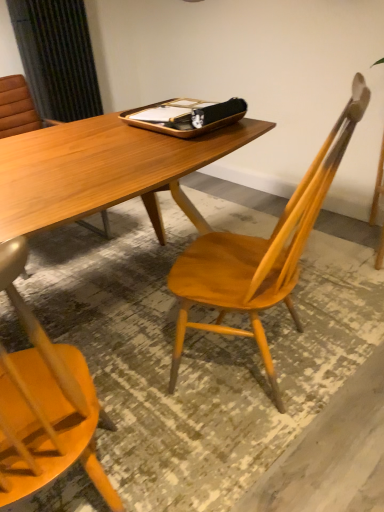
Question: In the image, is wooden tray at center on the left side or the right side of wooden chair at center?

Choices:
 (A) right
 (B) left

Answer: (B)

Question: Looking at the image, does wooden tray at center seem bigger or smaller compared to wooden chair at center?

Choices:
 (A) big
 (B) small

Answer: (B)

Question: Is point (215, 118) positioned closer to the camera than point (322, 155)?

Choices:
 (A) closer
 (B) farther

Answer: (B)

Question: From the image's perspective, is wooden chair at center positioned above or below wooden tray at center?

Choices:
 (A) above
 (B) below

Answer: (B)

Question: Considering the relative positions of wooden chair at center and wooden tray at center in the image provided, is wooden chair at center to the left or to the right of wooden tray at center?

Choices:
 (A) right
 (B) left

Answer: (A)

Question: Does point (344, 115) appear closer or farther from the camera than point (233, 101)?

Choices:
 (A) closer
 (B) farther

Answer: (A)

Question: Would you say wooden chair at center is inside or outside wooden tray at center?

Choices:
 (A) inside
 (B) outside

Answer: (B)